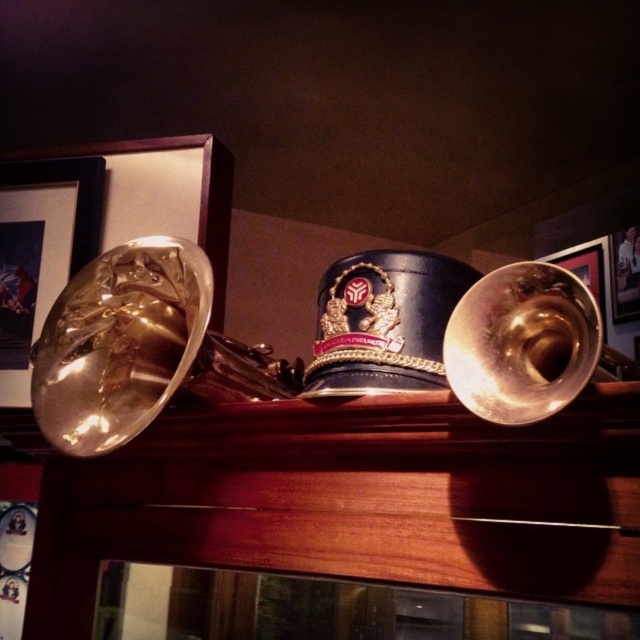
Question: Does gold polished trumpet at left appear under gold polished metal bass horn at right?

Choices:
 (A) yes
 (B) no

Answer: (B)

Question: Estimate the real-world distances between objects in this image. Which object is farther from the metallic gold trumpet at right?

Choices:
 (A) gold polished metal bass horn at right
 (B) gold shiny trumpet at left
 (C) gold polished trumpet at left
 (D) metallic gold picture frame at upper right

Answer: (B)

Question: Which point is farther to the camera?

Choices:
 (A) gold shiny trumpet at left
 (B) metallic gold picture frame at upper right
 (C) gold polished metal bass horn at right
 (D) metallic gold trumpet at right

Answer: (D)

Question: Estimate the real-world distances between objects in this image. Which object is farther from the metallic gold trumpet at right?

Choices:
 (A) metallic gold bell at left
 (B) metallic gold picture frame at upper right
 (C) gold polished trumpet at left
 (D) gold shiny trumpet at left

Answer: (A)

Question: From the image, what is the correct spatial relationship of metallic gold bell at left in relation to metallic gold picture frame at upper right?

Choices:
 (A) above
 (B) below

Answer: (B)

Question: From the image, what is the correct spatial relationship of metallic gold bell at left in relation to metallic gold trumpet at right?

Choices:
 (A) right
 (B) left

Answer: (B)